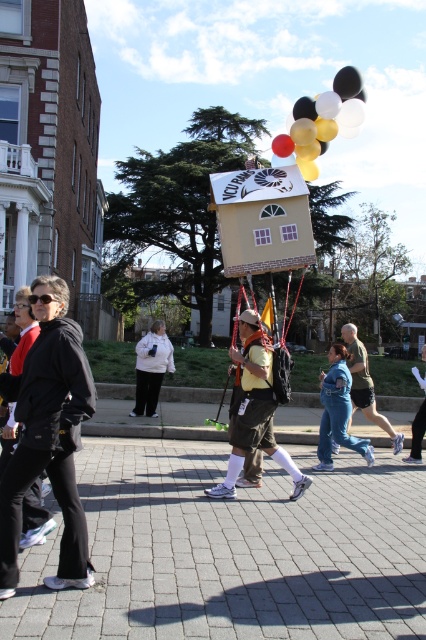
You are a photographer at the event and want to take a photo of the person carrying the float. Since the black matte jacket at left and denim pants at center are part of their outfit, will the jacket block the view of the pants in the photo?

The black matte jacket at left is in front of the denim pants at center, so the jacket will block the view of the pants in the photo.

You are standing in the middle of the brick pavement at center and want to hand a flyer to the person wearing the black matte jacket at left. Which direction should you move to approach them?

The black matte jacket at left is closer to you than the brick pavement at center, so you should move towards the left to approach them.